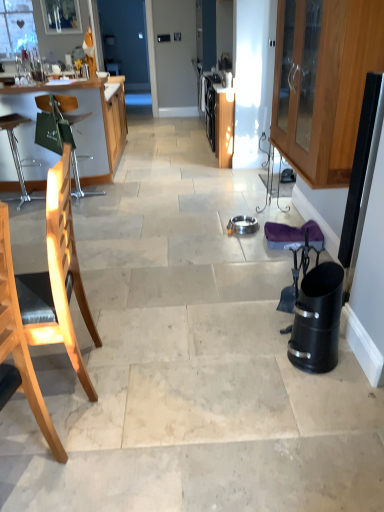
Locate an element on the screen. This screenshot has width=384, height=512. free space between black plastic swivel chair at right and wooden chair at left, which is counted as the first chair, starting from the back is located at coordinates (170, 251).